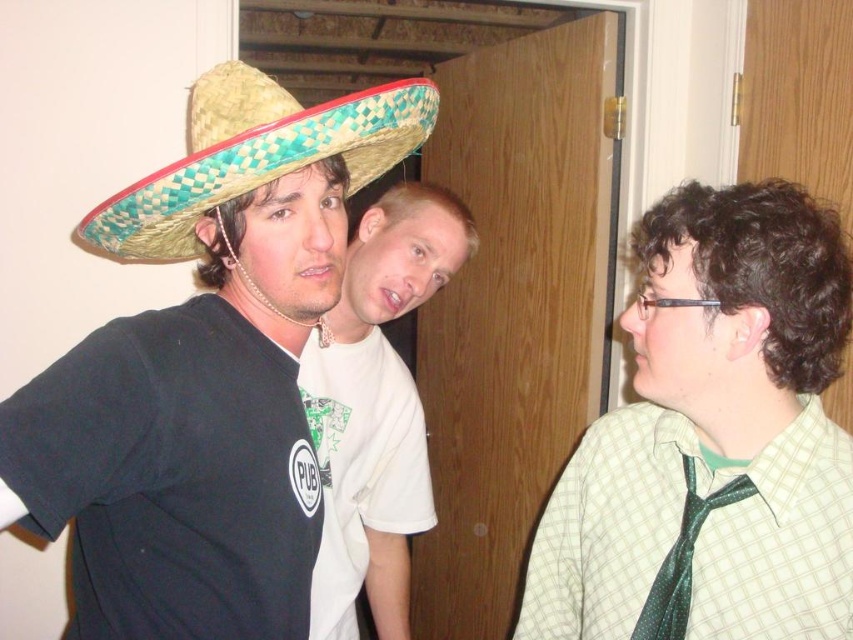
Question: From the image, what is the correct spatial relationship of white cotton t-shirt at center in relation to green dotted fabric tie at right?

Choices:
 (A) above
 (B) below

Answer: (A)

Question: Estimate the real-world distances between objects in this image. Which object is farther from the woven straw sombrero at upper left?

Choices:
 (A) white cotton t-shirt at center
 (B) green shiny tie at right
 (C) green dotted fabric tie at right
 (D) woven straw sombrero at left

Answer: (C)

Question: Can you confirm if woven straw sombrero at left is positioned above green dotted fabric tie at right?

Choices:
 (A) yes
 (B) no

Answer: (A)

Question: Which of these objects is positioned closest to the green shiny tie at right?

Choices:
 (A) white cotton t-shirt at center
 (B) woven straw sombrero at upper left

Answer: (A)

Question: Which object appears closest to the camera in this image?

Choices:
 (A) white cotton t-shirt at center
 (B) green dotted fabric tie at right
 (C) woven straw sombrero at upper left

Answer: (C)

Question: In this image, where is green shiny tie at right located relative to woven straw sombrero at upper left?

Choices:
 (A) below
 (B) above

Answer: (A)